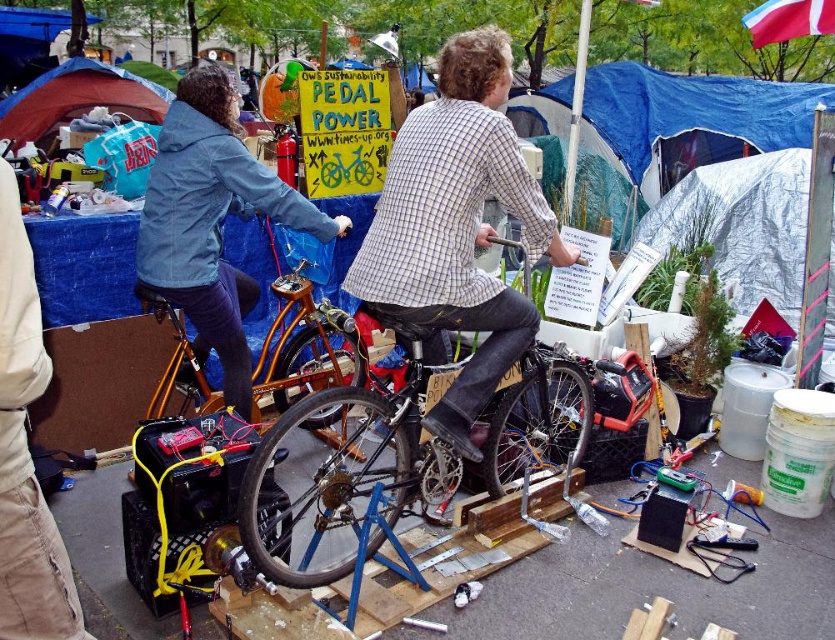
You are a participant in the event and need to move from the blue tarp at upper center to the silver reflective tarp at right while carrying a 1.5 meter long solar panel. Can you navigate the space between them without bending the panel?

The distance between the blue tarp at upper center and silver reflective tarp at right is 1.20 meters. Since the solar panel is 1.5 meters long, it cannot be carried straight without bending as the space is shorter than the panel.

You are organizing a community event and need to set up a booth. You have a denim jacket at upper left and a blue tarp tent at upper left. If the space allocated for your booth is only 1.5 meters wide, can both items fit side by side without overlapping?

The denim jacket at upper left is narrower than the blue tarp tent at upper left. However, without knowing the exact widths of both items, it is impossible to determine if they can fit within the 1.5 meters space. The description only states that the denim jacket is less wide than the tent, but not by how much.